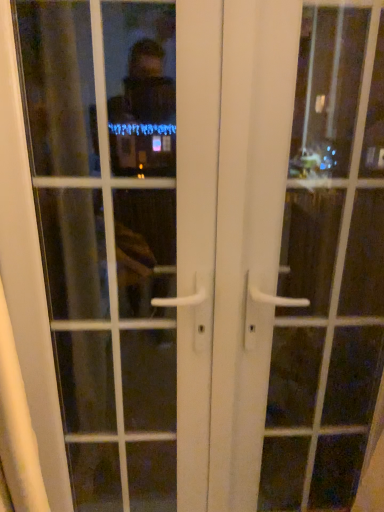
What do you see at coordinates (329, 266) in the screenshot?
I see `white glossy door handle at center` at bounding box center [329, 266].

The width and height of the screenshot is (384, 512). I want to click on white glossy door handle at center, so click(329, 266).

Find the location of a particular element. The width and height of the screenshot is (384, 512). white glossy door handle at center is located at coordinates (329, 266).